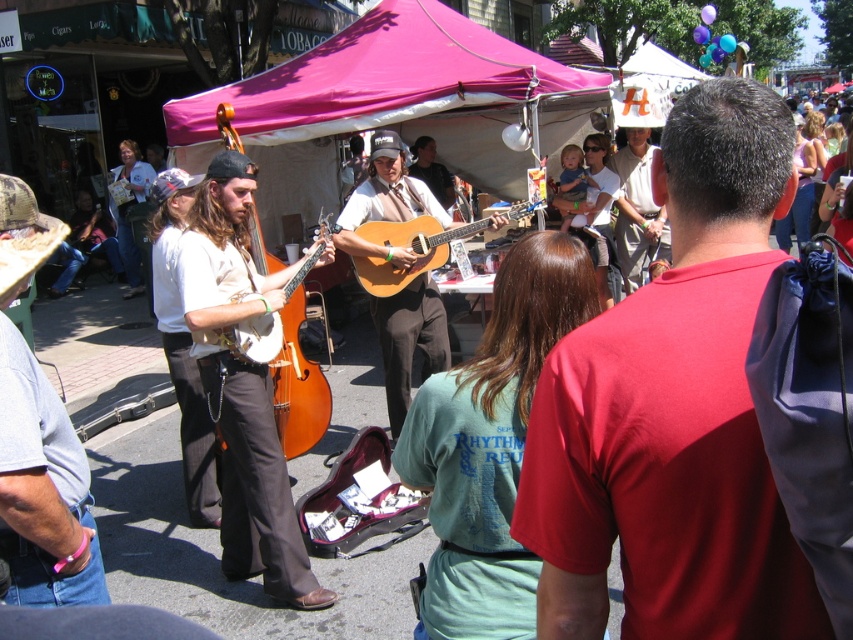
Question: Can you confirm if red cotton shirt at center is bigger than wooden acoustic guitar at center?

Choices:
 (A) yes
 (B) no

Answer: (B)

Question: Which object is positioned closest to the matte white banjo at center?

Choices:
 (A) matte brown guitar at center
 (B) red cotton shirt at center

Answer: (B)

Question: Which of the following is the farthest from the observer?

Choices:
 (A) (621, 342)
 (B) (271, 412)

Answer: (B)

Question: Which of the following is the closest to the observer?

Choices:
 (A) matte brown guitar at center
 (B) khaki cotton shirt at center
 (C) light gray cotton shirt at left

Answer: (C)

Question: Can you confirm if matte brown banjo at center is positioned below light gray cotton shirt at left?

Choices:
 (A) no
 (B) yes

Answer: (B)

Question: From the image, what is the correct spatial relationship of wooden acoustic guitar at center in relation to matte white banjo at center?

Choices:
 (A) right
 (B) left

Answer: (A)